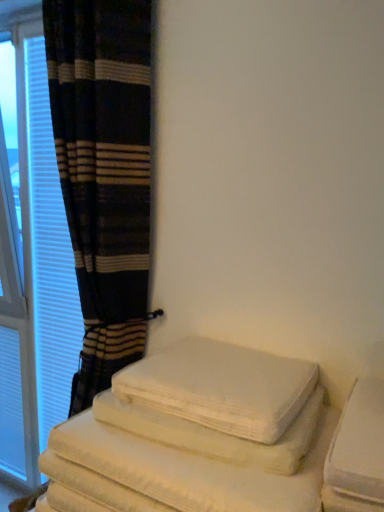
Question: Looking at the image, does white soft towels at lower left seem bigger or smaller compared to white textured curtain at left?

Choices:
 (A) big
 (B) small

Answer: (B)

Question: Is white soft towels at lower left taller or shorter than white textured curtain at left?

Choices:
 (A) tall
 (B) short

Answer: (B)

Question: Considering the real-world distances, which object is farthest from the white soft towels at lower left?

Choices:
 (A) plaid fabric curtain at left
 (B) white cotton bath towel at lower right
 (C) white textured curtain at left

Answer: (C)

Question: Which object is positioned closest to the plaid fabric curtain at left?

Choices:
 (A) white cotton bath towel at lower right
 (B) white textured curtain at left
 (C) white soft towels at lower left

Answer: (A)